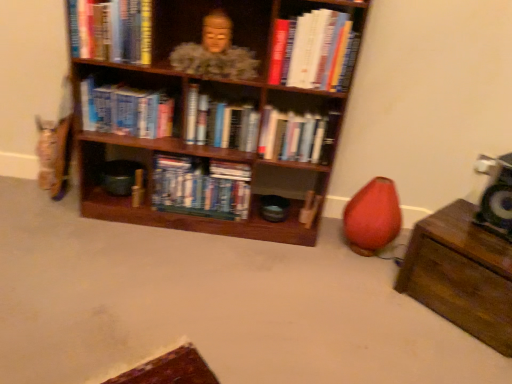
Question: Is hardcover books at center, placed as the 1th book when sorted from left to right, in contact with hardcover book at upper right, which appears as the 1th book when viewed from the right?

Choices:
 (A) yes
 (B) no

Answer: (B)

Question: From the image's perspective, is hardcover books at center, the sixth book positioned from the right, on top of hardcover book at upper right, which is counted as the sixth book, starting from the left?

Choices:
 (A) no
 (B) yes

Answer: (A)

Question: Can you confirm if hardcover books at center, the sixth book positioned from the right, is bigger than hardcover book at upper right, which appears as the 1th book when viewed from the right?

Choices:
 (A) yes
 (B) no

Answer: (A)

Question: Could hardcover book at upper right, which appears as the 1th book when viewed from the right, be considered to be inside hardcover books at center, the sixth book positioned from the right?

Choices:
 (A) no
 (B) yes

Answer: (A)

Question: Are hardcover books at center, the sixth book positioned from the right, and hardcover book at upper right, which is counted as the sixth book, starting from the left, far apart?

Choices:
 (A) yes
 (B) no

Answer: (B)

Question: Can you confirm if hardcover books at center, the sixth book positioned from the right, is shorter than hardcover book at upper right, which is counted as the sixth book, starting from the left?

Choices:
 (A) no
 (B) yes

Answer: (B)

Question: Is blue matte bookshelf at center, which appears as the fourth book when viewed from the right, bigger than matte pink bean bag chair at lower right?

Choices:
 (A) yes
 (B) no

Answer: (B)

Question: Is blue matte bookshelf at center, placed as the third book when sorted from left to right, touching matte pink bean bag chair at lower right?

Choices:
 (A) yes
 (B) no

Answer: (B)

Question: Is blue matte bookshelf at center, placed as the third book when sorted from left to right, oriented away from matte pink bean bag chair at lower right?

Choices:
 (A) yes
 (B) no

Answer: (B)

Question: Is blue matte bookshelf at center, which appears as the fourth book when viewed from the right, closer to the viewer compared to matte pink bean bag chair at lower right?

Choices:
 (A) no
 (B) yes

Answer: (A)

Question: Is blue matte bookshelf at center, which appears as the fourth book when viewed from the right, thinner than matte pink bean bag chair at lower right?

Choices:
 (A) no
 (B) yes

Answer: (B)

Question: Can you confirm if blue matte bookshelf at center, placed as the third book when sorted from left to right, is shorter than matte pink bean bag chair at lower right?

Choices:
 (A) no
 (B) yes

Answer: (B)

Question: Could you tell me if wooden bookshelf at center is facing hardcover books at center, which is counted as the second book, starting from the right?

Choices:
 (A) no
 (B) yes

Answer: (B)